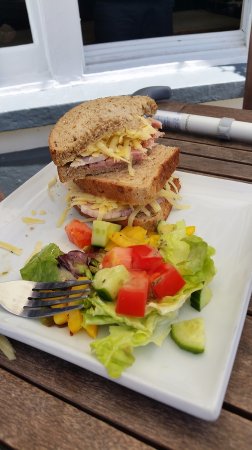
At what (x,y) coordinates should I click in order to perform the action: click on table. Please return your answer as a coordinate pair (x, y). Looking at the image, I should click on (44, 417).